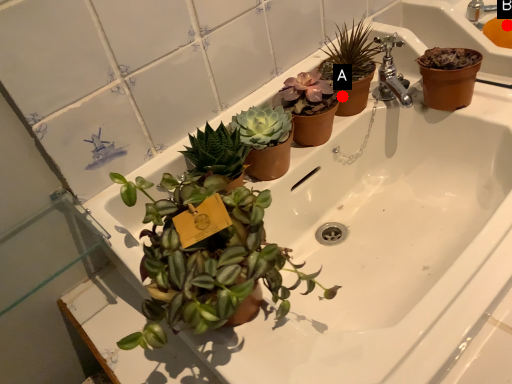
Question: Two points are circled on the image, labeled by A and B beside each circle. Which point appears closest to the camera in this image?

Choices:
 (A) A is closer
 (B) B is closer

Answer: (A)